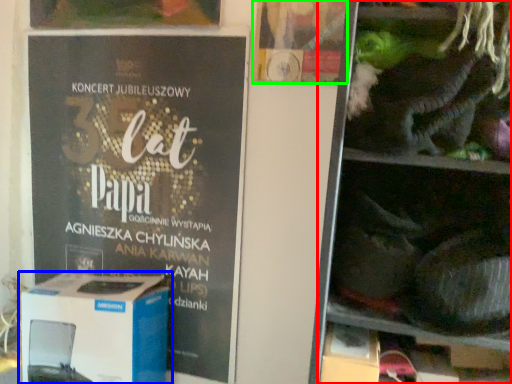
Question: Based on their relative distances, which object is farther from shelf (highlighted by a red box)? Choose from box (highlighted by a blue box) and flyer (highlighted by a green box).

Choices:
 (A) box
 (B) flyer

Answer: (A)